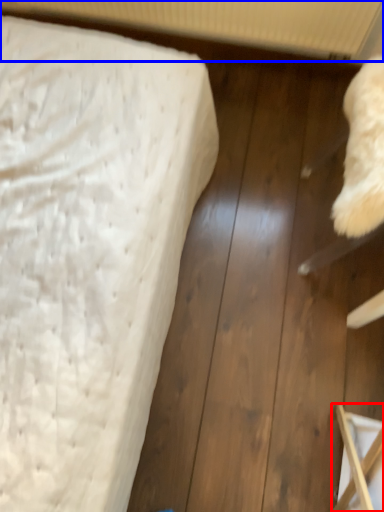
Question: Among these objects, which one is farthest to the camera, furniture (highlighted by a red box) or radiator (highlighted by a blue box)?

Choices:
 (A) furniture
 (B) radiator

Answer: (B)